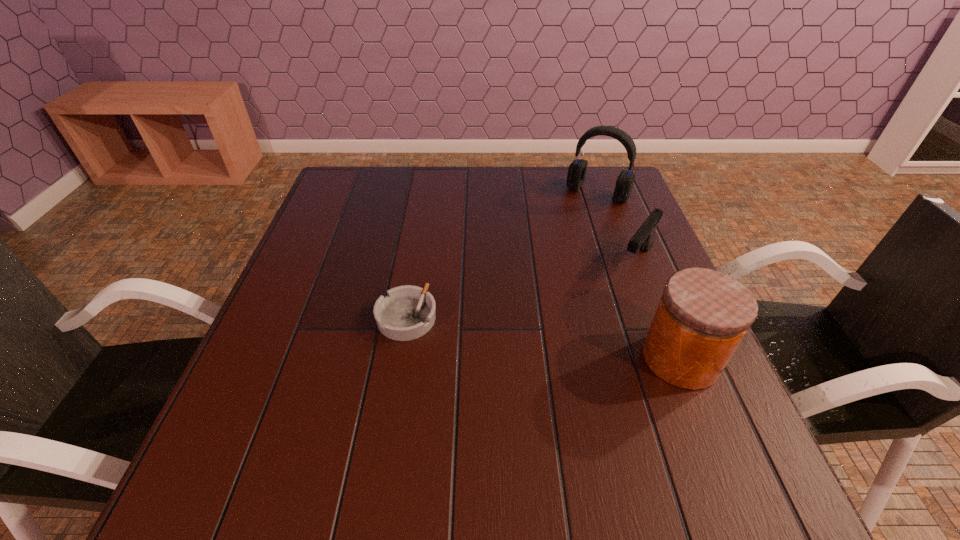
You are a GUI agent. You are given a task and a screenshot of the screen. Output one action in this format:
    pyautogui.click(x=<x>, y=<y>)
    Task: Click on the free space on the desktop that is between the ashtray and the jar and is positioned on the front-facing side of the third tallest object
    Image resolution: width=960 pixels, height=540 pixels.
    Given the screenshot: What is the action you would take?
    pyautogui.click(x=576, y=343)

Where is `free space on the desktop that is between the shortest object and the jar and is positioned on the headband of the farthest object`? The width and height of the screenshot is (960, 540). free space on the desktop that is between the shortest object and the jar and is positioned on the headband of the farthest object is located at coordinates (501, 332).